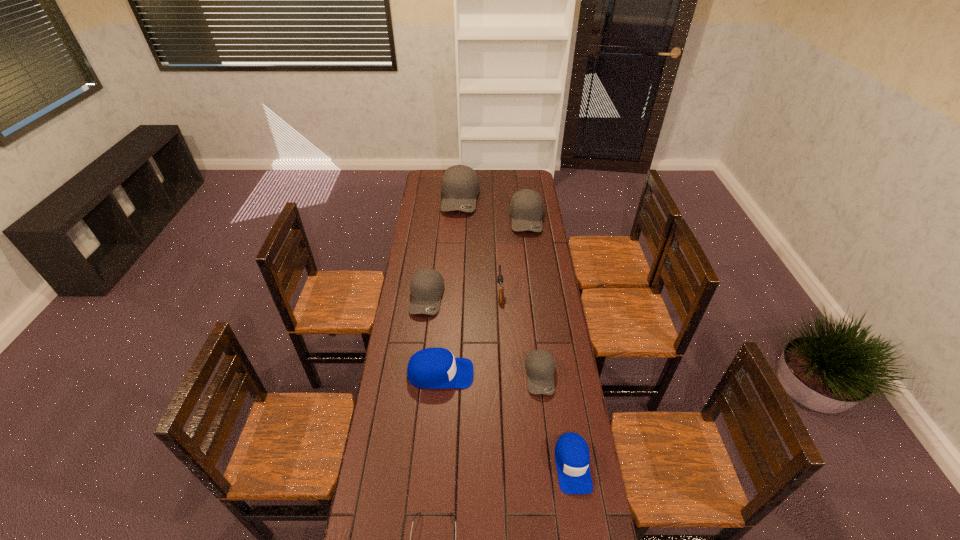
Where is `free space located on the front brim of the nearest gray baseball cap`? free space located on the front brim of the nearest gray baseball cap is located at coordinates (554, 490).

Image resolution: width=960 pixels, height=540 pixels. In order to click on vacant region located on the front-facing side of the right blue baseball cap in this screenshot , I will do `click(580, 512)`.

Locate an element on the screen. This screenshot has width=960, height=540. object at the far edge is located at coordinates (460, 186).

Locate an element on the screen. object located in the far left corner section of the desktop is located at coordinates (460, 186).

In the image, there is a desktop. Find the location of `free space at the far edge`. free space at the far edge is located at coordinates (493, 173).

Where is `vacant space at the left edge`? This screenshot has height=540, width=960. vacant space at the left edge is located at coordinates (439, 242).

In the image, there is a desktop. Where is `vacant space at the right edge`? vacant space at the right edge is located at coordinates (537, 239).

The image size is (960, 540). Identify the location of vacant space at the far left corner. (441, 171).

The image size is (960, 540). What are the coordinates of `vacant region at the far right corner of the desktop` in the screenshot? It's located at (516, 181).

This screenshot has width=960, height=540. I want to click on vacant area that lies between the smallest gray baseball cap and the nearer blue baseball cap, so click(x=557, y=420).